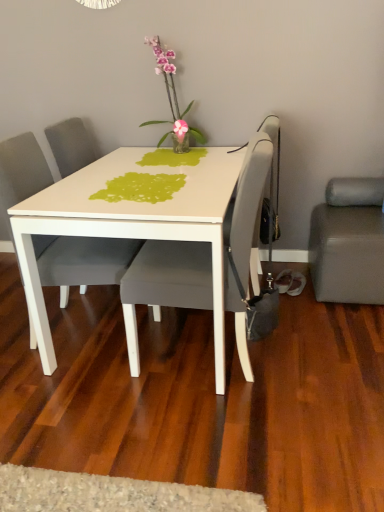
Question: Considering the relative positions of matte gray chair at center, which is counted as the first chair, starting from the right, and translucent glass vase at upper center in the image provided, is matte gray chair at center, which is counted as the first chair, starting from the right, to the left or to the right of translucent glass vase at upper center?

Choices:
 (A) right
 (B) left

Answer: (A)

Question: From the image's perspective, relative to translucent glass vase at upper center, is matte gray chair at center, the 2th chair in the left-to-right sequence, above or below?

Choices:
 (A) below
 (B) above

Answer: (A)

Question: Based on their relative distances, which object is nearer to the suede gray studio couch at lower right?

Choices:
 (A) translucent glass vase at upper center
 (B) matte gray chair at center, which is counted as the first chair, starting from the right
 (C) matte gray chair at center, the first chair viewed from the left

Answer: (B)

Question: Which object is the farthest from the translucent glass vase at upper center?

Choices:
 (A) matte gray chair at center, the first chair viewed from the left
 (B) matte gray chair at center, the 2th chair in the left-to-right sequence
 (C) suede gray studio couch at lower right

Answer: (C)